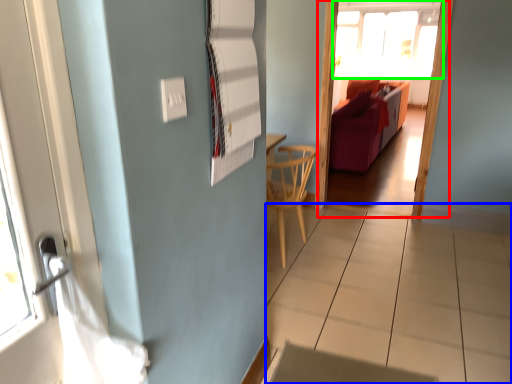
Question: Which object is positioned farthest from screen door (highlighted by a red box)? Select from tile (highlighted by a blue box) and window (highlighted by a green box).

Choices:
 (A) tile
 (B) window

Answer: (B)